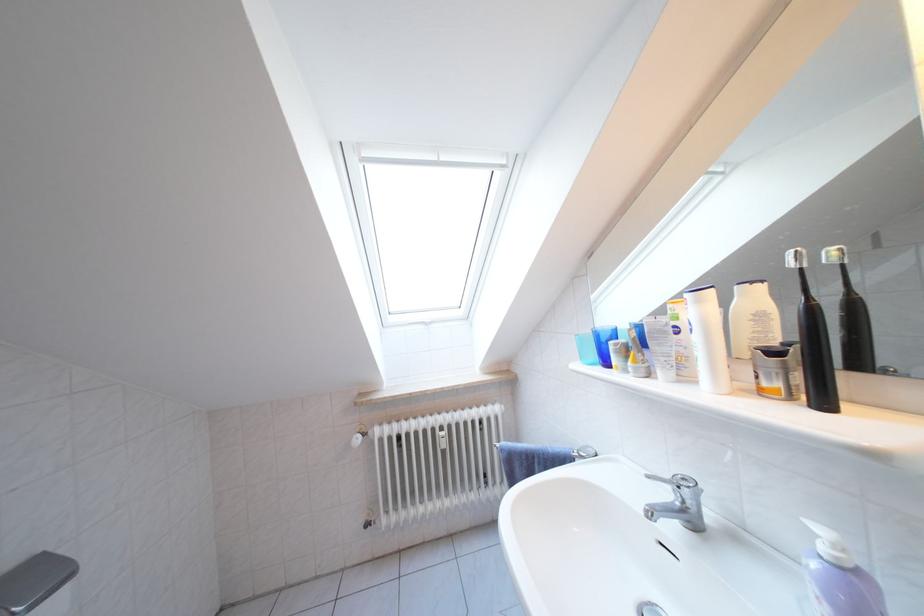
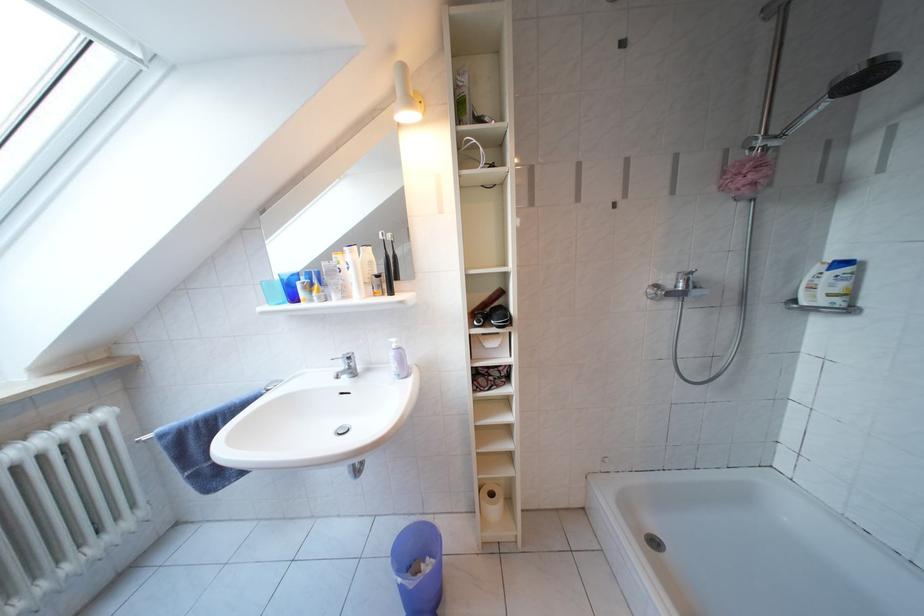
Question: The camera is either moving clockwise (left) or counter-clockwise (right) around the object. The first image is from the beginning of the video and the second image is from the end. Is the camera moving left or right when shooting the video?

Choices:
 (A) Left
 (B) Right

Answer: (A)